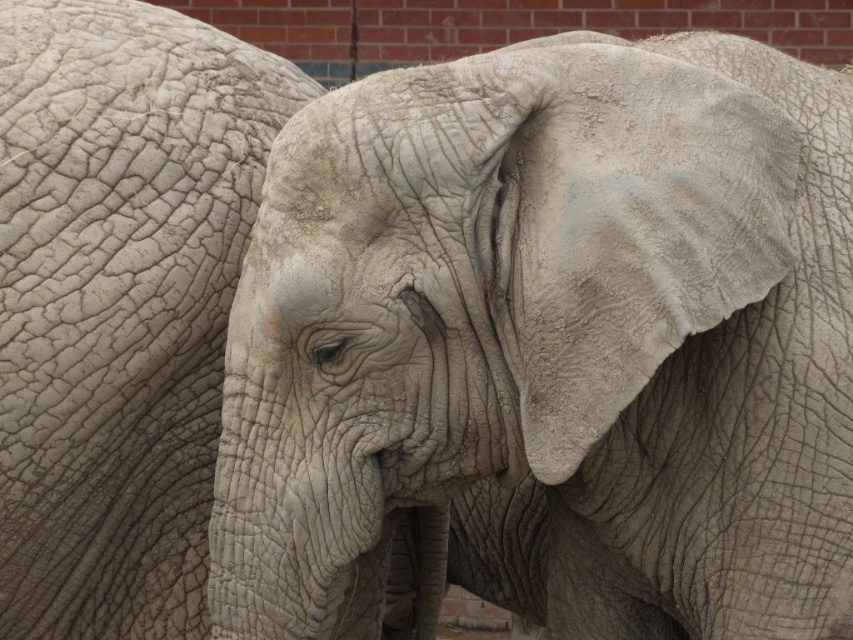
You are a wildlife photographer trying to capture both the gray textured elephant at center and the gray rough skin at left in a single frame. Based on their positions, do you think you can fit both into your camera viewfinder without moving your position?

The gray textured elephant at center might be wider than gray rough skin at left, so it is possible to fit both into the camera viewfinder as long as their combined width does not exceed the viewfinder capacity.

You are a photographer trying to capture the elephant in the foreground. You notice two points marked in the image. Which point, point (393, 193) or point (196, 282), is closer to your camera lens?

Point (393, 193) is closer to the camera lens than point (196, 282).

Based on the photo, you are observing two elephants in the image. According to the scene description, where is the gray textured elephant at center relative to the gray rough skin at left?

The gray textured elephant at center is positioned under the gray rough skin at left.